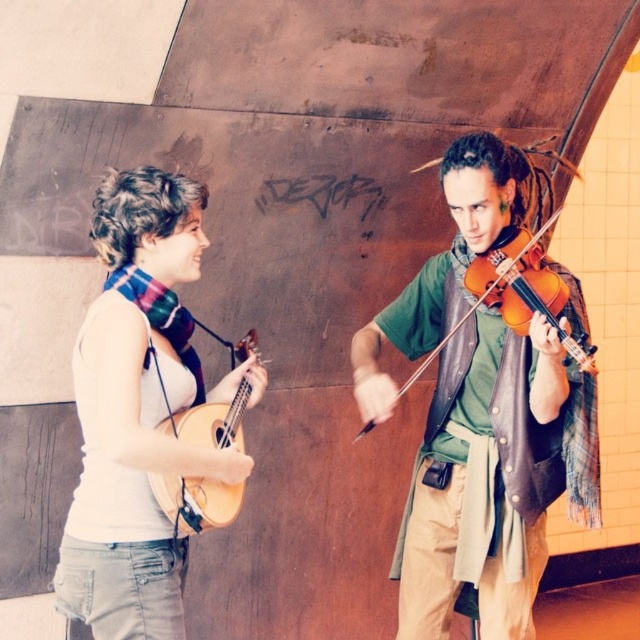
What do you see at coordinates (516, 294) in the screenshot?
I see `orange matte violin at right` at bounding box center [516, 294].

Is point (464, 316) less distant than point (224, 493)?

No, it is not.

Is point (561, 301) closer to camera compared to point (188, 481)?

No, (561, 301) is further to viewer.

The width and height of the screenshot is (640, 640). In order to click on orange matte violin at right in this screenshot , I will do `click(516, 294)`.

Is matte green shirt at center to the right of orange matte violin at right from the viewer's perspective?

Indeed, matte green shirt at center is positioned on the right side of orange matte violin at right.

I want to click on matte green shirt at center, so click(481, 416).

Is point (525, 406) less distant than point (544, 278)?

No, (525, 406) is behind (544, 278).

In order to click on matte green shirt at center in this screenshot , I will do click(x=481, y=416).

Does point (131, 600) come closer to viewer compared to point (230, 433)?

That is True.

Which is below, white matte guitar at left or light brown wooden ukulele at left?

white matte guitar at left

Which is in front, point (186, 193) or point (182, 484)?

Point (182, 484) is in front.

This screenshot has height=640, width=640. I want to click on white matte guitar at left, so click(138, 410).